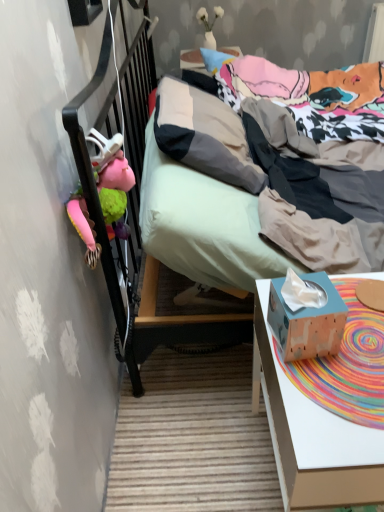
Question: Is white matte vase at upper center, which is the 1th toy in top-to-bottom order, closer to the viewer compared to wooden tissue box at lower right?

Choices:
 (A) no
 (B) yes

Answer: (A)

Question: Would you say wooden tissue box at lower right is part of white matte vase at upper center, which appears as the first toy when viewed from the right,'s contents?

Choices:
 (A) no
 (B) yes

Answer: (A)

Question: Can you confirm if white matte vase at upper center, the second toy viewed from the front, is positioned to the right of wooden tissue box at lower right?

Choices:
 (A) no
 (B) yes

Answer: (A)

Question: From the image's perspective, does white matte vase at upper center, which appears as the first toy when viewed from the right, appear lower than wooden tissue box at lower right?

Choices:
 (A) no
 (B) yes

Answer: (A)

Question: From a real-world perspective, is white matte vase at upper center, which ranks as the 2th toy in bottom-to-top order, located higher than wooden tissue box at lower right?

Choices:
 (A) yes
 (B) no

Answer: (A)

Question: Based on their sizes in the image, would you say pink fabric stuffed animal at left, which is counted as the 1th toy, starting from the bottom, is bigger or smaller than white matte vase at upper center, which is the 1th toy in top-to-bottom order?

Choices:
 (A) small
 (B) big

Answer: (B)

Question: Considering the positions of pink fabric stuffed animal at left, which ranks as the first toy in left-to-right order, and white matte vase at upper center, which is the 1th toy in top-to-bottom order, in the image, is pink fabric stuffed animal at left, which ranks as the first toy in left-to-right order, wider or thinner than white matte vase at upper center, which is the 1th toy in top-to-bottom order,?

Choices:
 (A) wide
 (B) thin

Answer: (B)

Question: From the image's perspective, relative to white matte vase at upper center, which ranks as the 2th toy in bottom-to-top order, is pink fabric stuffed animal at left, the second toy when ordered from back to front, above or below?

Choices:
 (A) below
 (B) above

Answer: (A)

Question: Considering their positions, is pink fabric stuffed animal at left, which is counted as the 1th toy, starting from the bottom, located in front of or behind white matte vase at upper center, which ranks as the second toy in left-to-right order?

Choices:
 (A) behind
 (B) front

Answer: (B)

Question: Do you think pink fabric stuffed animal at left, which is counted as the second toy, starting from the right, is within wooden tissue box at lower right, or outside of it?

Choices:
 (A) inside
 (B) outside

Answer: (B)

Question: Considering their positions, is pink fabric stuffed animal at left, which is counted as the 1th toy, starting from the bottom, located in front of or behind wooden tissue box at lower right?

Choices:
 (A) front
 (B) behind

Answer: (B)

Question: Looking at the image, does pink fabric stuffed animal at left, placed as the 1th toy when sorted from front to back, seem bigger or smaller compared to wooden tissue box at lower right?

Choices:
 (A) small
 (B) big

Answer: (B)

Question: Does point (115, 160) appear closer or farther from the camera than point (269, 309)?

Choices:
 (A) closer
 (B) farther

Answer: (B)

Question: Is point (279, 280) closer or farther from the camera than point (205, 10)?

Choices:
 (A) closer
 (B) farther

Answer: (A)

Question: From a real-world perspective, is wooden tissue box at lower right positioned above or below white matte vase at upper center, which appears as the first toy when viewed from the right?

Choices:
 (A) below
 (B) above

Answer: (A)